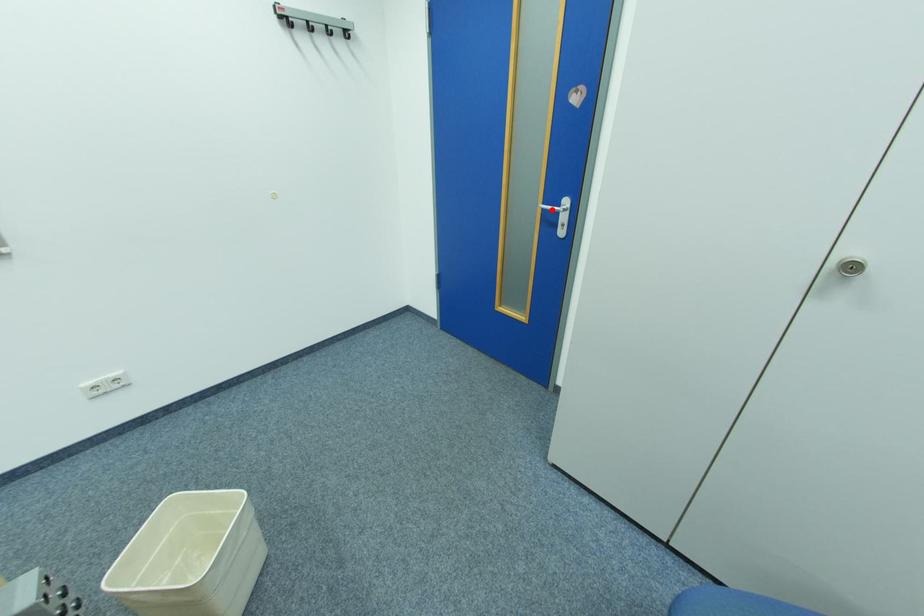
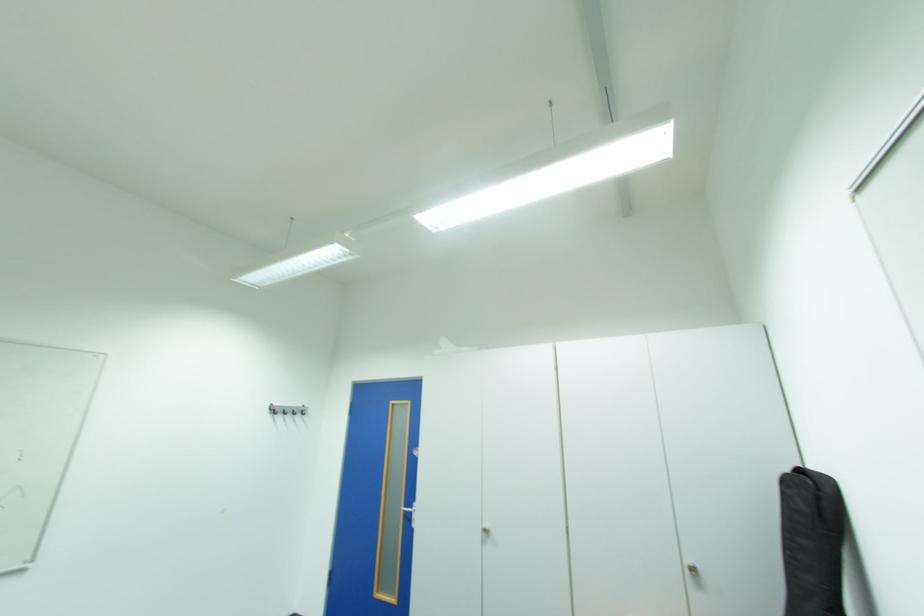
The point at the highlighted location is marked in the first image. Where is the corresponding point in the second image?

(414, 511)